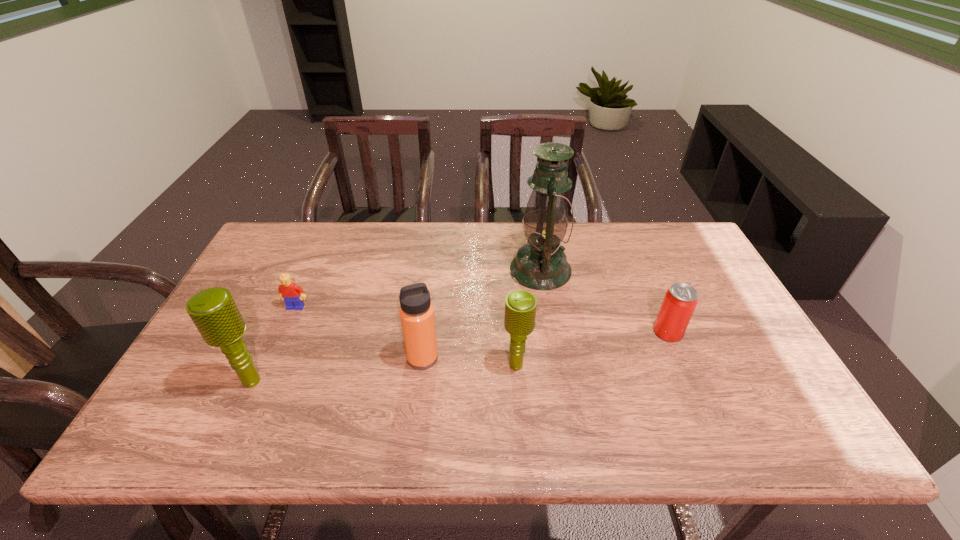
Where is `vacant space located on the back of the shorter microphone`? Image resolution: width=960 pixels, height=540 pixels. vacant space located on the back of the shorter microphone is located at coordinates (510, 276).

The height and width of the screenshot is (540, 960). I want to click on vacant space situated on the face of the Lego, so click(280, 341).

Where is `vacant space located on the left of the second shortest object`? The width and height of the screenshot is (960, 540). vacant space located on the left of the second shortest object is located at coordinates (509, 332).

You are a GUI agent. You are given a task and a screenshot of the screen. Output one action in this format:
    pyautogui.click(x=<x>, y=<y>)
    Task: Click on the vacant space located 0.190m on the front of the oil lamp
    
    Given the screenshot: What is the action you would take?
    pyautogui.click(x=552, y=343)

Locate an element on the screen. vacant space located 0.120m on the right of the thermos bottle is located at coordinates (487, 358).

What are the coordinates of `object that is at the far edge` in the screenshot? It's located at (541, 264).

At what (x,y) coordinates should I click in order to perform the action: click on microphone located at the left edge. Please return your answer as a coordinate pair (x, y). Looking at the image, I should click on (214, 312).

Locate an element on the screen. The height and width of the screenshot is (540, 960). Lego located in the left edge section of the desktop is located at coordinates [293, 296].

I want to click on object that is at the near left corner, so click(214, 312).

What are the coordinates of `free point at the far edge` in the screenshot? It's located at (472, 223).